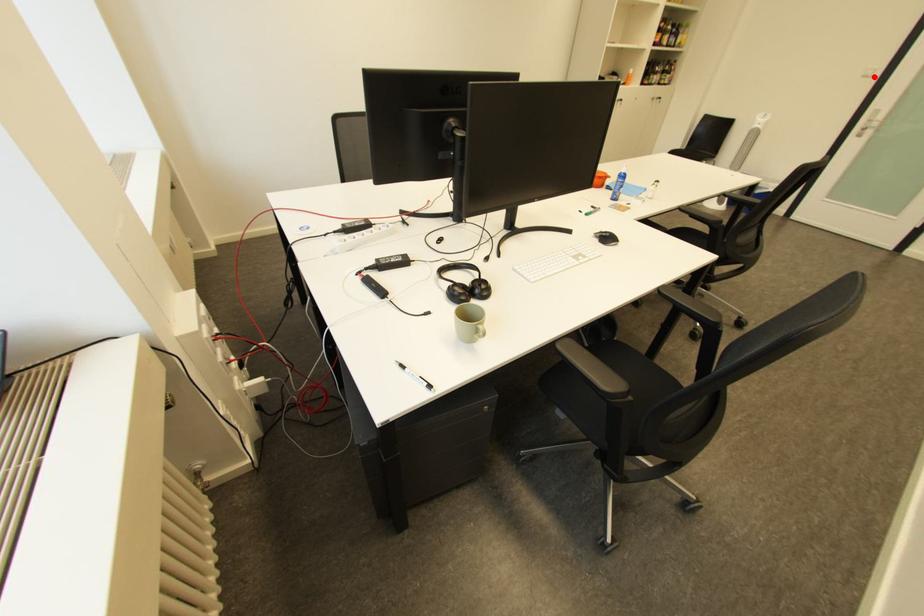
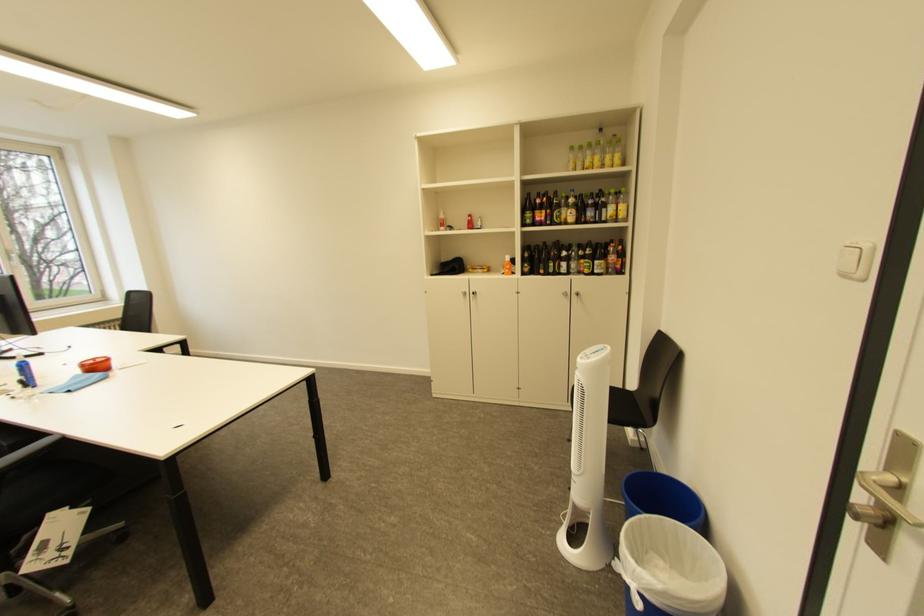
In the second image, find the point that corresponds to the highlighted location in the first image.

(855, 277)